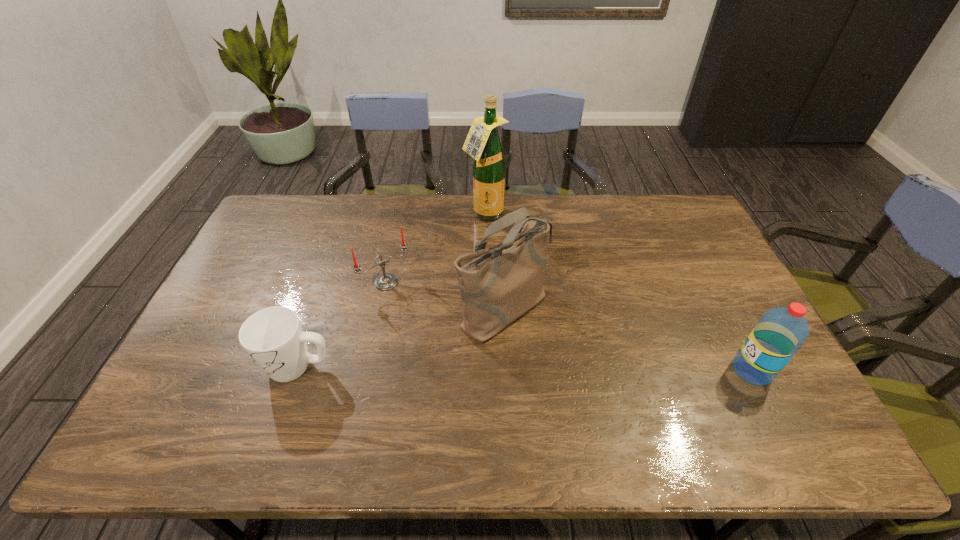
Locate an element on the screen. The height and width of the screenshot is (540, 960). mug is located at coordinates (273, 337).

Find the location of a particular element. The image size is (960, 540). the rightmost object is located at coordinates (780, 332).

The image size is (960, 540). Find the location of `water bottle`. water bottle is located at coordinates (780, 332).

Find the location of `liquor`. liquor is located at coordinates (483, 143).

Locate an element on the screen. Image resolution: width=960 pixels, height=540 pixels. candle is located at coordinates (386, 281).

Where is `shoulder bag`? shoulder bag is located at coordinates (497, 285).

Identify the location of blank area located 0.140m on the side of the leftmost object with the handle. This screenshot has width=960, height=540. (209, 367).

The width and height of the screenshot is (960, 540). In order to click on vacant area located 0.110m on the side of the leftmost object with the handle in this screenshot , I will do `click(221, 367)`.

This screenshot has height=540, width=960. Identify the location of free spot located on the side of the leftmost object with the handle. (209, 367).

This screenshot has height=540, width=960. I want to click on free space located on the front label of the third shortest object, so [x=694, y=370].